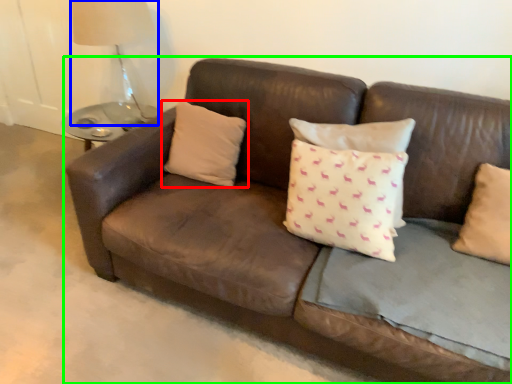
Question: Which is farther away from pillow (highlighted by a red box)? table lamp (highlighted by a blue box) or studio couch (highlighted by a green box)?

Choices:
 (A) table lamp
 (B) studio couch

Answer: (A)